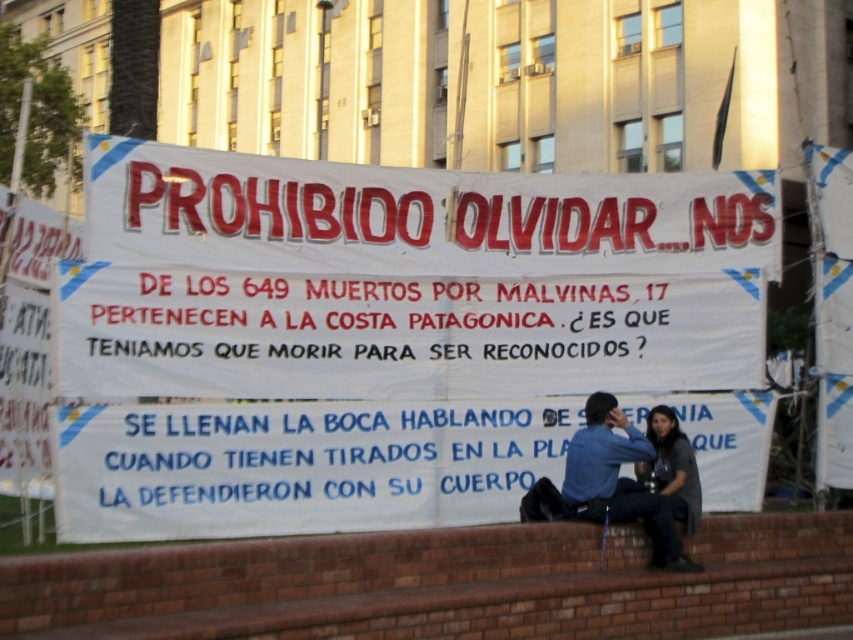
You are a photographer trying to capture the protest banner. You notice the brick ledge at lower center and the dark gray fabric shirt at lower right in your frame. Which object should you adjust your camera angle to focus on if you want to highlight the wider object?

The brick ledge at lower center is wider than the dark gray fabric shirt at lower right, so you should adjust your camera angle to focus on the brick ledge at lower center to highlight the wider object.